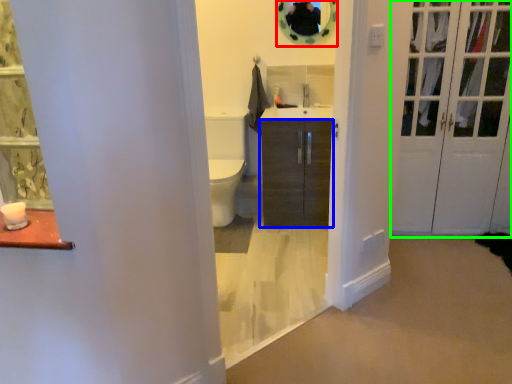
Question: Based on their relative distances, which object is farther from mirror (highlighted by a red box)? Choose from cabinetry (highlighted by a blue box) and door (highlighted by a green box).

Choices:
 (A) cabinetry
 (B) door

Answer: (B)